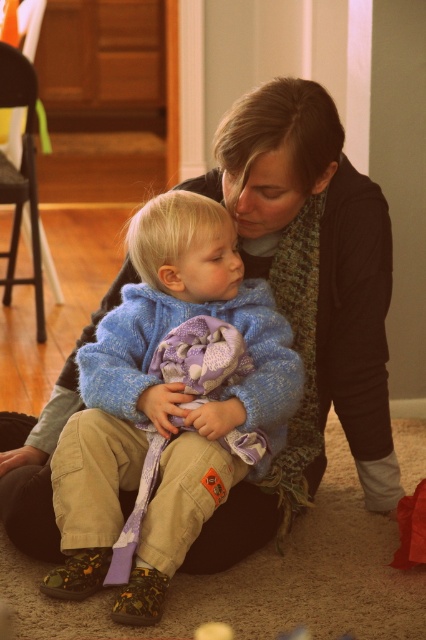
You are designing a clothing catalog and need to arrange the knitted scarf at center and blue knitted sweater at center side by side. Which item should you place on the left if you want the thinner item to be on the left?

You should place the knitted scarf at center on the left because it is thinner than the blue knitted sweater at center.

You are an observer in the room. You notice the knitted scarf at center and the blue knitted sweater at center. Which item is positioned higher up in the image?

The knitted scarf at center is taller than the blue knitted sweater at center, so the knitted scarf at center is positioned higher up.